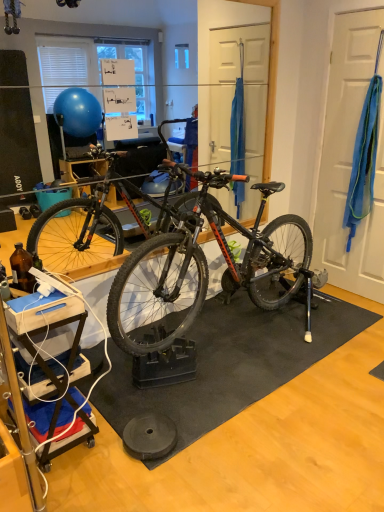
Question: Is black rubber mat at center at the right side of blue fabric at right?

Choices:
 (A) no
 (B) yes

Answer: (A)

Question: From a real-world perspective, is black rubber mat at center on top of blue fabric at right?

Choices:
 (A) yes
 (B) no

Answer: (B)

Question: Does black rubber mat at center have a larger size compared to blue fabric at right?

Choices:
 (A) yes
 (B) no

Answer: (A)

Question: Can you confirm if black rubber mat at center is smaller than blue fabric at right?

Choices:
 (A) no
 (B) yes

Answer: (A)

Question: From a real-world perspective, is black rubber mat at center physically below blue fabric at right?

Choices:
 (A) no
 (B) yes

Answer: (B)

Question: Is black rubber mat at center positioned beyond the bounds of blue fabric at right?

Choices:
 (A) no
 (B) yes

Answer: (B)

Question: Is blue fabric at right positioned before black rubber mat at center?

Choices:
 (A) no
 (B) yes

Answer: (A)

Question: From the image's perspective, is blue fabric at right located beneath black rubber mat at center?

Choices:
 (A) no
 (B) yes

Answer: (A)

Question: Is blue fabric at right not near black rubber mat at center?

Choices:
 (A) no
 (B) yes

Answer: (B)

Question: Considering the relative sizes of blue fabric at right and black rubber mat at center in the image provided, is blue fabric at right bigger than black rubber mat at center?

Choices:
 (A) yes
 (B) no

Answer: (B)

Question: Does blue fabric at right have a smaller size compared to black rubber mat at center?

Choices:
 (A) no
 (B) yes

Answer: (B)

Question: Can you confirm if blue fabric at right is wider than black rubber mat at center?

Choices:
 (A) yes
 (B) no

Answer: (B)

Question: Considering the positions of black rubber mat at center and blue fabric at right in the image, is black rubber mat at center taller or shorter than blue fabric at right?

Choices:
 (A) short
 (B) tall

Answer: (A)